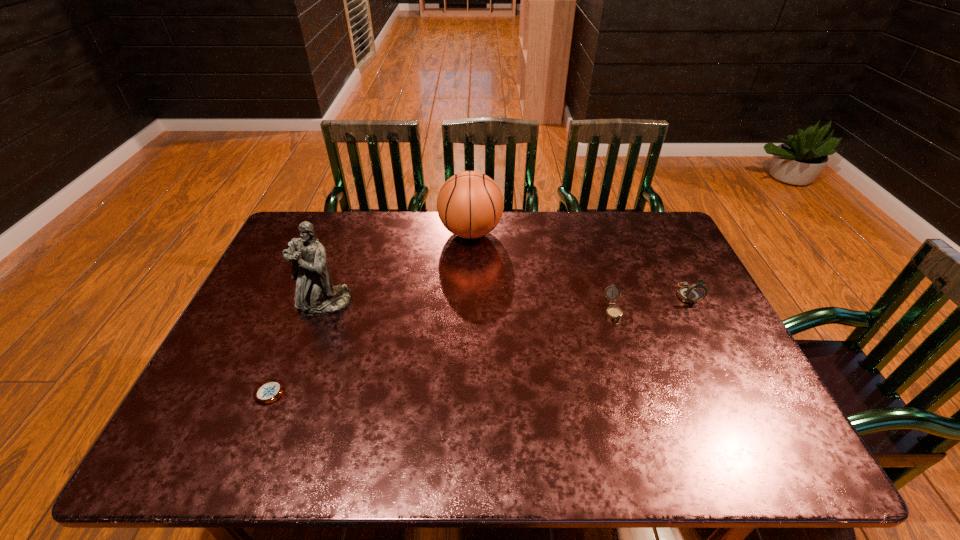
Find the location of a particular element. figurine is located at coordinates (315, 295).

Locate an element on the screen. This screenshot has width=960, height=540. the second tallest object is located at coordinates (470, 204).

The image size is (960, 540). Find the location of `basketball`. basketball is located at coordinates (x=470, y=204).

The width and height of the screenshot is (960, 540). Find the location of `the tallest compass`. the tallest compass is located at coordinates (691, 294).

The image size is (960, 540). Identify the location of the rightmost compass. (691, 294).

In order to click on the second compass from right to left in this screenshot , I will do `click(615, 313)`.

I want to click on the second shortest compass, so click(x=615, y=313).

Locate an element on the screen. The image size is (960, 540). the leftmost compass is located at coordinates (268, 391).

Find the location of `the shortest object`. the shortest object is located at coordinates [268, 391].

Locate an element on the screen. The width and height of the screenshot is (960, 540). vacant region located on the front-facing side of the tallest object is located at coordinates (311, 338).